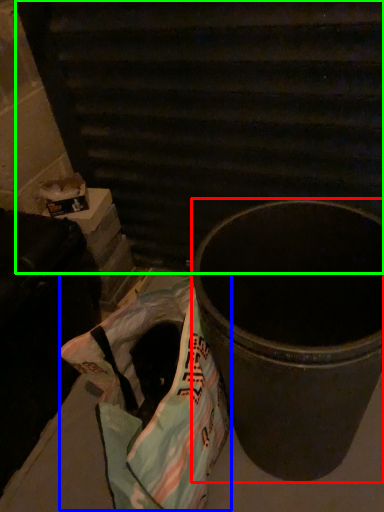
Question: Estimate the real-world distances between objects in this image. Which object is farther from waste container (highlighted by a red box), grocery bag (highlighted by a blue box) or stairwell (highlighted by a green box)?

Choices:
 (A) grocery bag
 (B) stairwell

Answer: (B)